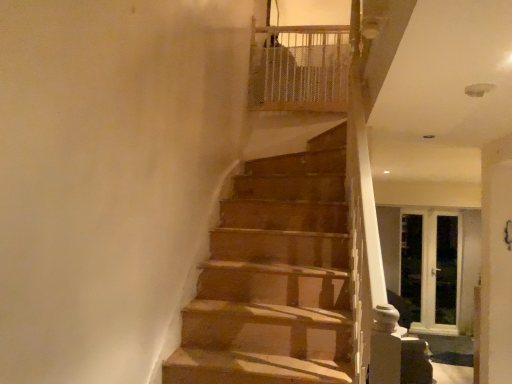
Question: Considering the positions of white wooden screen door at right, positioned as the second screen door in left-to-right order, and white glass screen door at right, the first screen door in the right-to-left sequence, in the image, is white wooden screen door at right, positioned as the second screen door in left-to-right order, bigger or smaller than white glass screen door at right, the first screen door in the right-to-left sequence,?

Choices:
 (A) big
 (B) small

Answer: (A)

Question: Choose the correct answer: Is white wooden screen door at right, which is the 2th screen door from right to left, inside white glass screen door at right, arranged as the third screen door when viewed from the left, or outside it?

Choices:
 (A) inside
 (B) outside

Answer: (A)

Question: Which of these objects is positioned farthest from the white glass screen door at right, arranged as the third screen door when viewed from the left?

Choices:
 (A) white wooden screen door at right, positioned as the second screen door in left-to-right order
 (B) white mesh balustrade at upper center
 (C) clear glass screen door at right, which ranks as the 1th screen door in left-to-right order

Answer: (B)

Question: Which object is the farthest from the white glass screen door at right, the first screen door in the right-to-left sequence?

Choices:
 (A) white wooden screen door at right, positioned as the second screen door in left-to-right order
 (B) white mesh balustrade at upper center
 (C) clear glass screen door at right, acting as the 3th screen door starting from the right

Answer: (B)